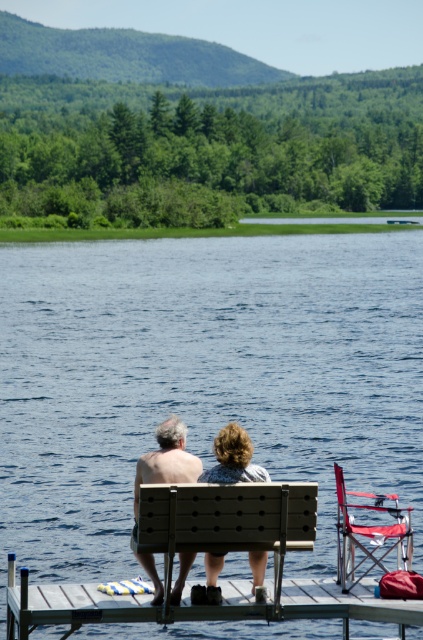
Question: Which object is closer to the camera taking this photo?

Choices:
 (A) wooden dock at lower center
 (B) red fabric director's chair at right
 (C) matte wood bench at center

Answer: (A)

Question: Which point is closer to the camera?

Choices:
 (A) (213, 572)
 (B) (173, 429)
 (C) (412, 538)
 (D) (285, 502)

Answer: (D)

Question: Is wooden bench at center below red fabric director's chair at right?

Choices:
 (A) no
 (B) yes

Answer: (A)

Question: Is red fabric director's chair at right smaller than matte wood bench at center?

Choices:
 (A) no
 (B) yes

Answer: (A)

Question: Which of the following is the farthest from the observer?

Choices:
 (A) matte gray shorts at center
 (B) wooden bench at center
 (C) wooden dock at lower center

Answer: (A)

Question: Does blue water at center lie in front of red fabric director's chair at right?

Choices:
 (A) no
 (B) yes

Answer: (A)